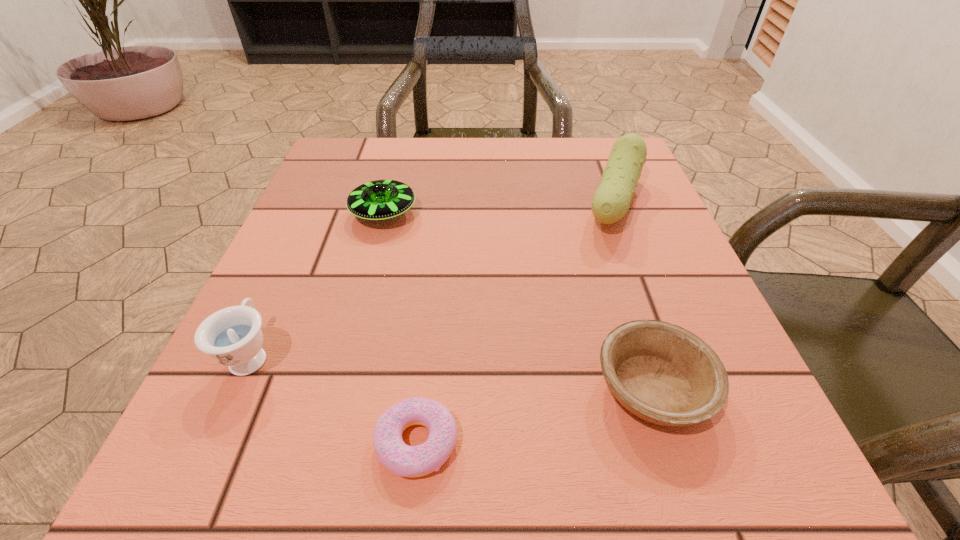
You are a GUI agent. You are given a task and a screenshot of the screen. Output one action in this format:
    pyautogui.click(x=<x>, y=<y>)
    Task: Click on the cucumber
    This screenshot has height=540, width=960.
    Given the screenshot: What is the action you would take?
    pyautogui.click(x=611, y=201)

Find the location of `the leftmost object`. the leftmost object is located at coordinates (232, 336).

Locate an element on the screen. The width and height of the screenshot is (960, 540). saucer is located at coordinates (378, 200).

Find the location of a particular element. bowl is located at coordinates (662, 373).

The width and height of the screenshot is (960, 540). I want to click on the shortest object, so click(x=401, y=459).

Locate an element on the screen. The height and width of the screenshot is (540, 960). blank area located on the left of the cucumber is located at coordinates (442, 202).

Identify the location of free space located on the side of the teacup with the handle. This screenshot has height=540, width=960. (308, 228).

What are the coordinates of `free point located on the side of the teacup with the handle` in the screenshot? It's located at (322, 198).

I want to click on free space located on the side of the teacup with the handle, so click(x=328, y=185).

The height and width of the screenshot is (540, 960). I want to click on free space located 0.170m on the right of the saucer, so click(503, 213).